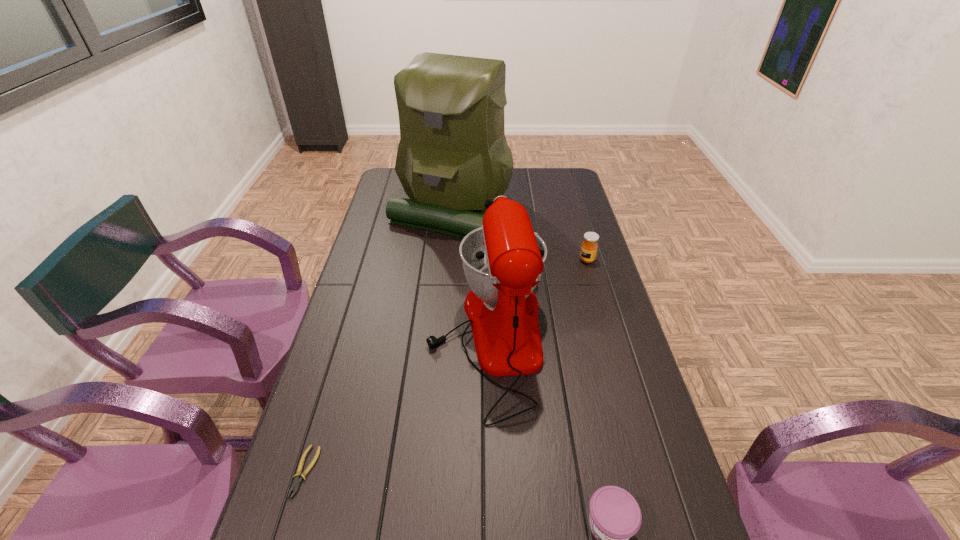
Identify the location of backpack. The height and width of the screenshot is (540, 960). (453, 155).

Locate an element on the screen. The height and width of the screenshot is (540, 960). the farthest object is located at coordinates (453, 155).

At what (x,y) coordinates should I click in order to perform the action: click on the third nearest object. Please return your answer as a coordinate pair (x, y). Looking at the image, I should click on coord(503,260).

Where is `the second tallest object`? Image resolution: width=960 pixels, height=540 pixels. the second tallest object is located at coordinates (503, 260).

At what (x,y) coordinates should I click in order to perform the action: click on the third tallest object. Please return your answer as a coordinate pair (x, y). This screenshot has height=540, width=960. Looking at the image, I should click on (x=589, y=247).

Identify the location of honey. 589,247.

The height and width of the screenshot is (540, 960). Identify the location of the second nearest object. (296, 484).

Where is `the leftmost object`? This screenshot has width=960, height=540. the leftmost object is located at coordinates (296, 484).

In order to click on blank space located on the front of the backpack with visible pockets in this screenshot , I will do `click(446, 264)`.

Find the location of a particular element. Image resolution: width=960 pixels, height=540 pixels. blank area located on the bowl side of the fourth shortest object is located at coordinates (343, 339).